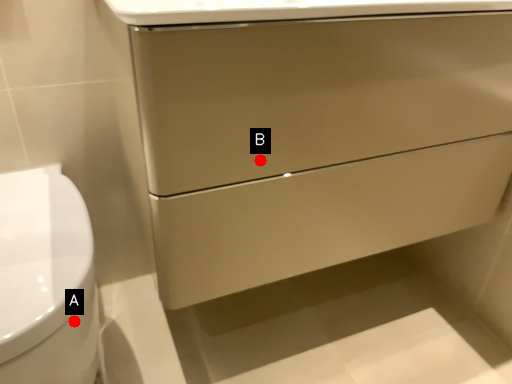
Question: Two points are circled on the image, labeled by A and B beside each circle. Which point is closer to the camera?

Choices:
 (A) A is closer
 (B) B is closer

Answer: (A)